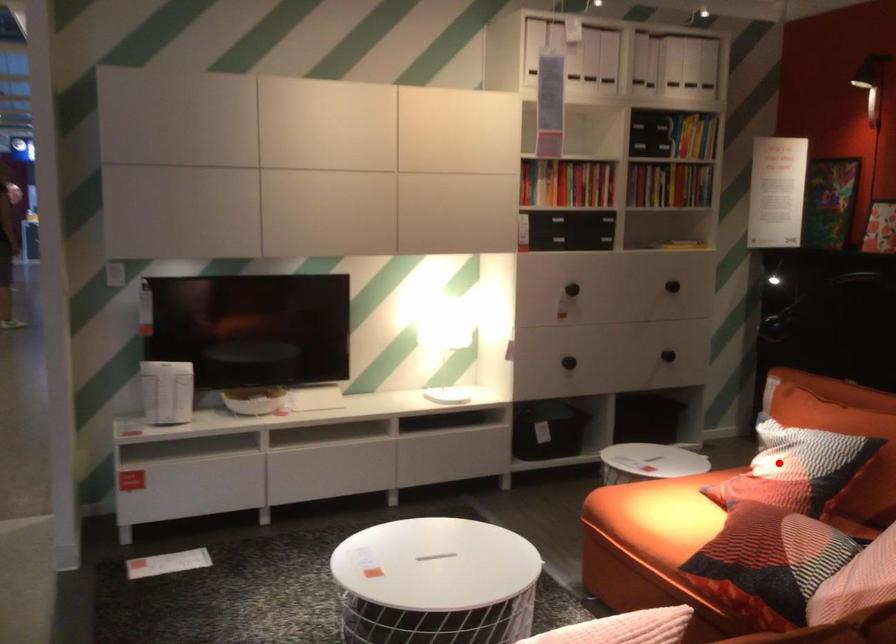
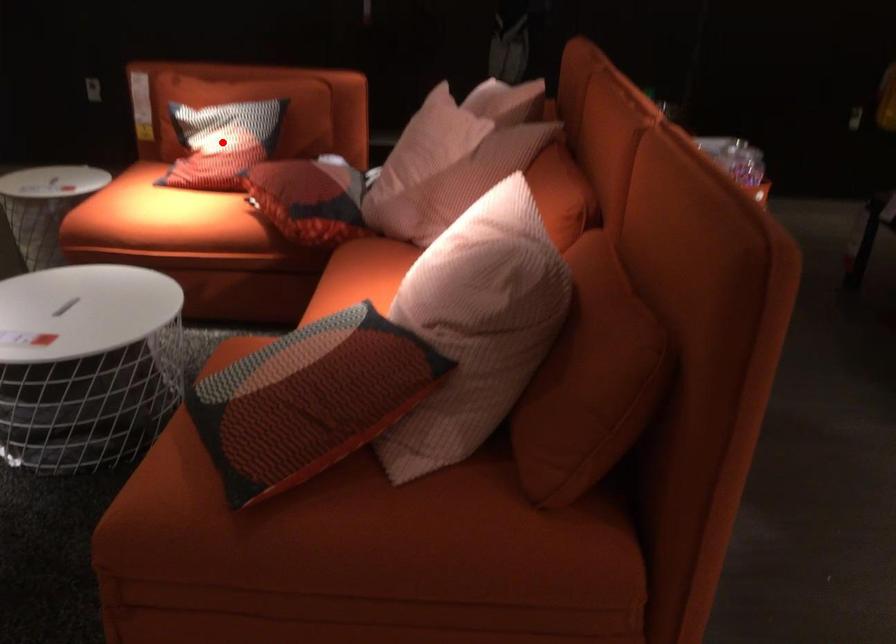
I am providing you with two images of the same scene from different viewpoints. A red point is marked on the first image and another point is marked on the second image. Do the highlighted points in image1 and image2 indicate the same real-world spot?

Yes